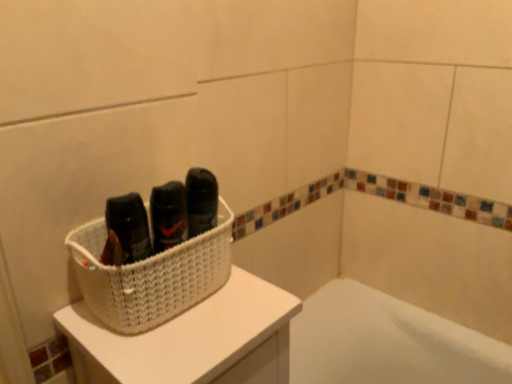
The height and width of the screenshot is (384, 512). Find the location of `free space in front of white woven basket at upper left`. free space in front of white woven basket at upper left is located at coordinates tap(166, 350).